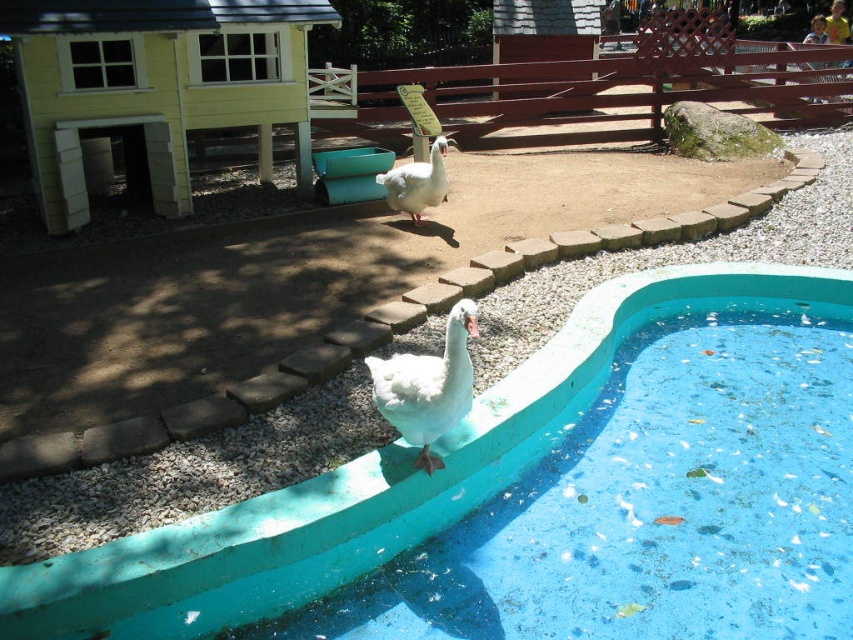
Question: Is blue rubber swimming pool at center positioned in front of white fluffy duck at lower center?

Choices:
 (A) no
 (B) yes

Answer: (B)

Question: Which object is the farthest from the white fluffy duck at lower center?

Choices:
 (A) white matte duck at upper center
 (B) blue rubber swimming pool at center

Answer: (A)

Question: Does blue rubber swimming pool at center have a greater width compared to white fluffy duck at lower center?

Choices:
 (A) no
 (B) yes

Answer: (B)

Question: Which point is closer to the camera?

Choices:
 (A) (418, 211)
 (B) (68, 589)
 (C) (426, 442)

Answer: (B)

Question: Which object is positioned farthest from the white fluffy duck at lower center?

Choices:
 (A) white matte duck at upper center
 (B) blue rubber swimming pool at center

Answer: (A)

Question: Is white fluffy duck at lower center closer to camera compared to white matte duck at upper center?

Choices:
 (A) yes
 (B) no

Answer: (A)